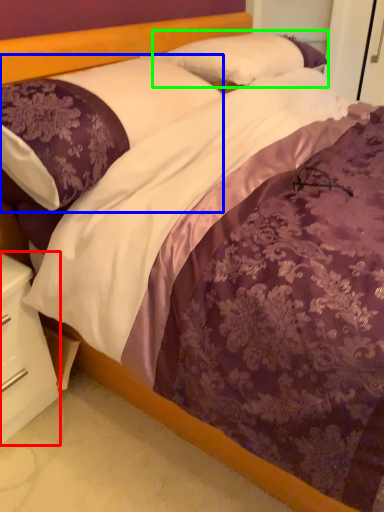
Question: Which object is the closest to the nightstand (highlighted by a red box)? Choose among these: pillow (highlighted by a blue box) or pillow (highlighted by a green box).

Choices:
 (A) pillow
 (B) pillow

Answer: (A)